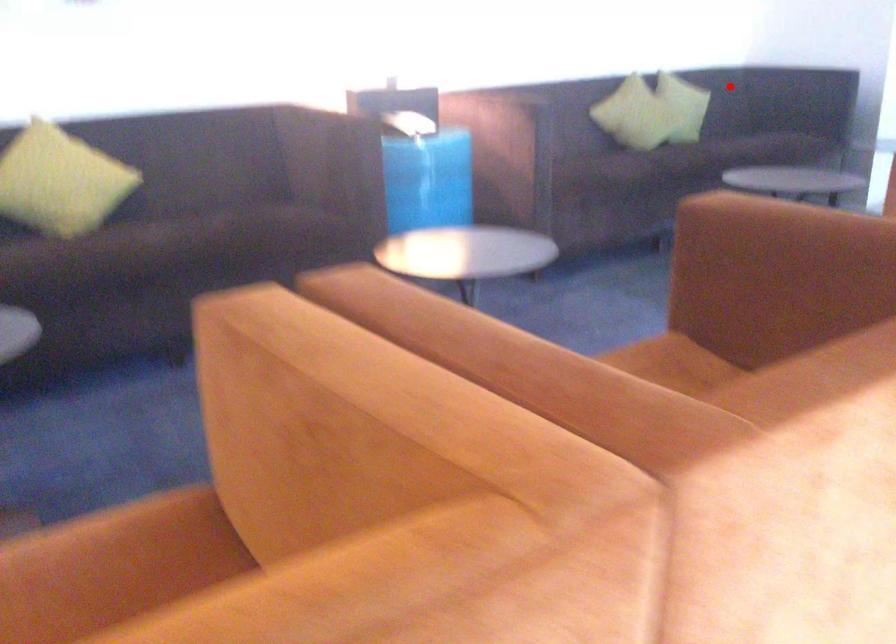
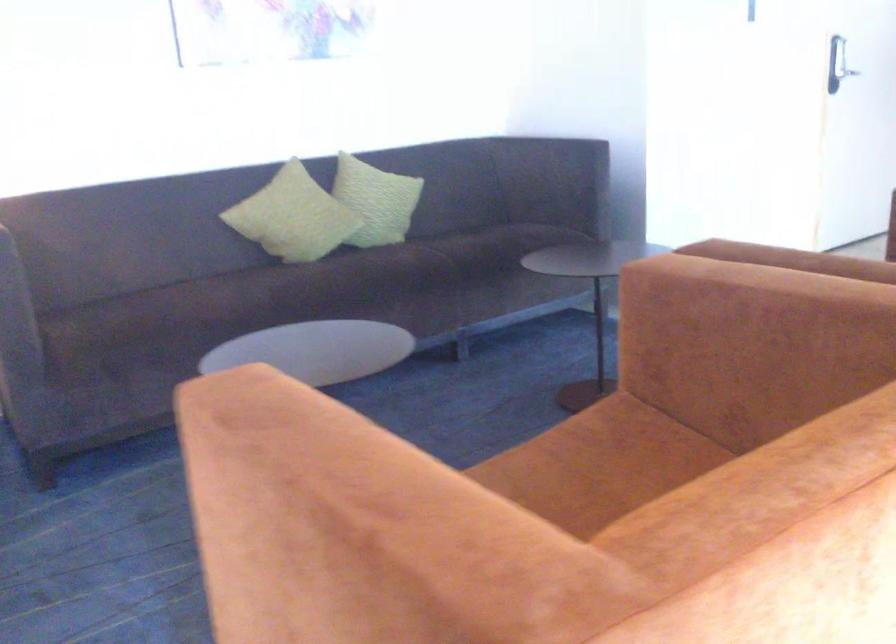
Question: I am providing you with two images of the same scene from different viewpoints. Image1 has a red point marked. In image2, the corresponding 3D location appears at what relative position? Reply with the corresponding letter.

Choices:
 (A) Closer
 (B) Farther

Answer: (A)